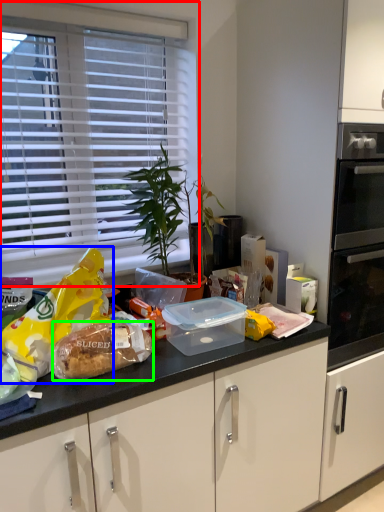
Question: Which object is the farthest from window blind (highlighted by a red box)? Choose among these: snack (highlighted by a blue box) or food (highlighted by a green box).

Choices:
 (A) snack
 (B) food

Answer: (B)